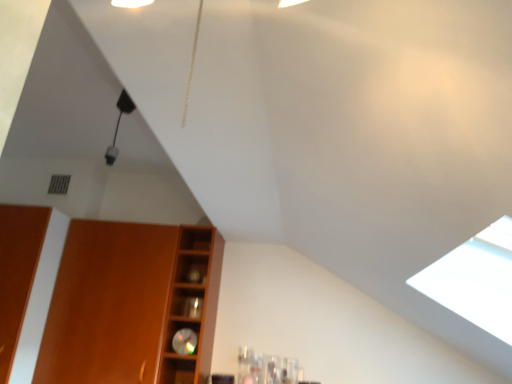
Question: Is matte wood cabinet at left taller or shorter than wooden shelf at center?

Choices:
 (A) short
 (B) tall

Answer: (B)

Question: Is matte wood cabinet at left spatially inside wooden shelf at center, or outside of it?

Choices:
 (A) inside
 (B) outside

Answer: (B)

Question: Is point (66, 299) closer or farther from the camera than point (181, 228)?

Choices:
 (A) farther
 (B) closer

Answer: (B)

Question: From a real-world perspective, is wooden shelf at center above or below matte wood cabinet at left?

Choices:
 (A) below
 (B) above

Answer: (B)

Question: Is wooden shelf at center situated inside matte wood cabinet at left or outside?

Choices:
 (A) inside
 (B) outside

Answer: (B)

Question: In terms of size, does wooden shelf at center appear bigger or smaller than matte wood cabinet at left?

Choices:
 (A) small
 (B) big

Answer: (A)

Question: From their relative heights in the image, would you say wooden shelf at center is taller or shorter than matte wood cabinet at left?

Choices:
 (A) short
 (B) tall

Answer: (A)